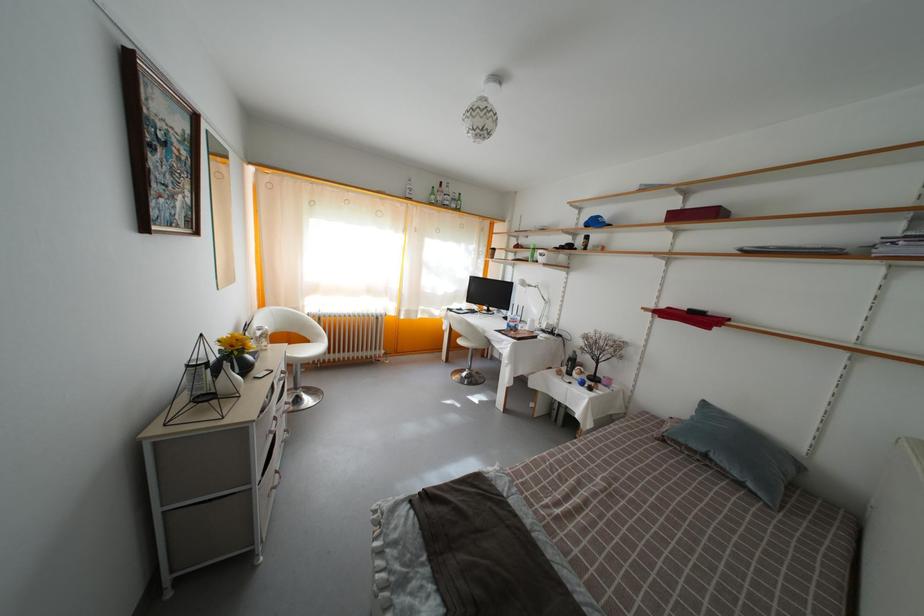
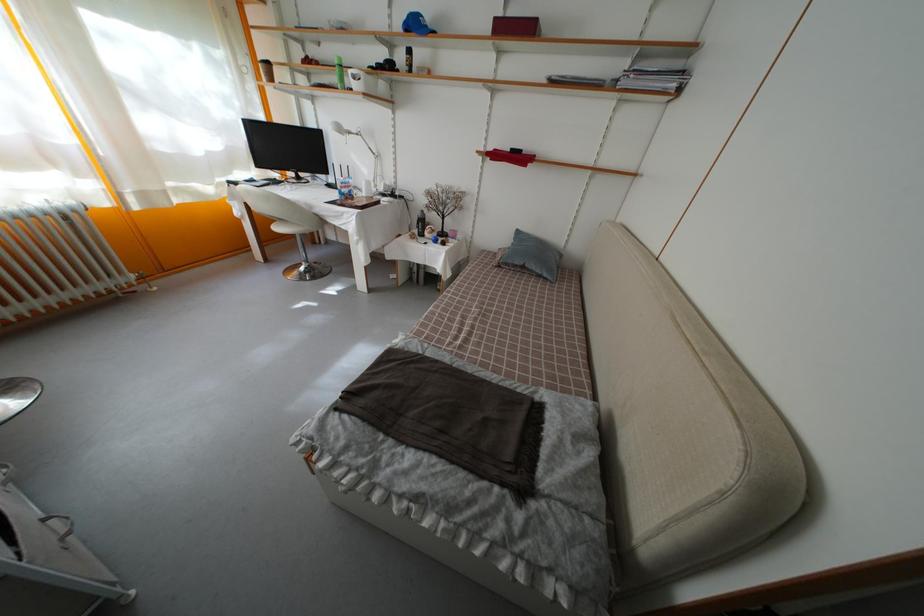
Based on the continuous images, in which direction is the camera rotating?

The camera's rotation is toward right-down.